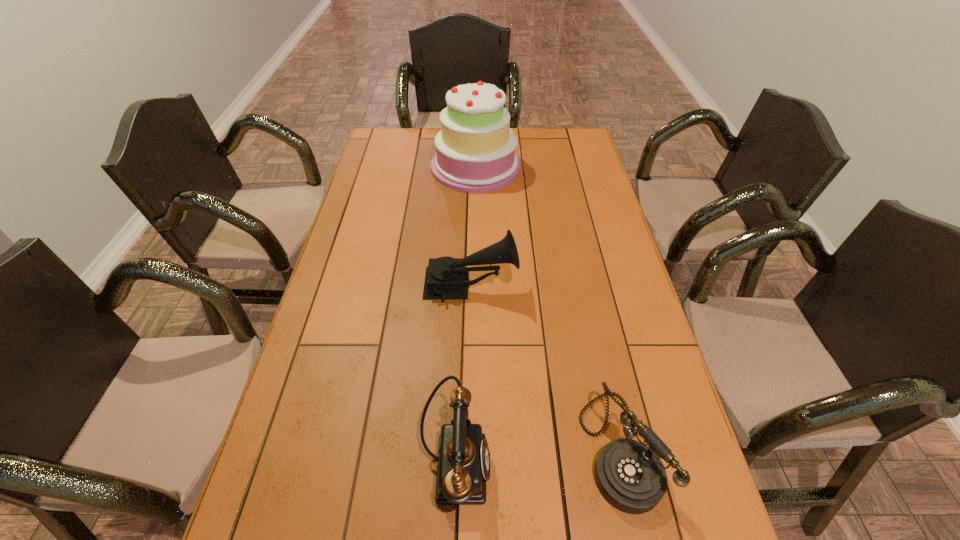
You are a GUI agent. You are given a task and a screenshot of the screen. Output one action in this format:
    pyautogui.click(x=<x>, y=<y>)
    Task: Click on the farthest object
    This screenshot has width=960, height=540.
    Given the screenshot: What is the action you would take?
    pyautogui.click(x=475, y=149)

What are the coordinates of `the tallest object` in the screenshot? It's located at (475, 149).

Identify the location of phonograph_record. (446, 277).

You are a GUI agent. You are given a task and a screenshot of the screen. Output one action in this format:
    pyautogui.click(x=<x>, y=<y>)
    Task: Click on the taller telephone
    
    Given the screenshot: What is the action you would take?
    pyautogui.click(x=463, y=466)

At what (x,y) coordinates should I click in order to perform the action: click on the shortest object. Please return your answer as a coordinate pair (x, y). Looking at the image, I should click on (630, 476).

Identify the location of the rightmost object. (630, 476).

Where is `free space located on the right of the tallest object`? The height and width of the screenshot is (540, 960). free space located on the right of the tallest object is located at coordinates (548, 167).

Identify the location of vacant point located from the horn of the second farthest object. Image resolution: width=960 pixels, height=540 pixels. (621, 286).

Where is `free space located on the front of the left telephone at the rotary dial`? The image size is (960, 540). free space located on the front of the left telephone at the rotary dial is located at coordinates (576, 464).

Locate an element on the screen. The width and height of the screenshot is (960, 540). vacant area situated 0.110m on the left of the rightmost object is located at coordinates (533, 448).